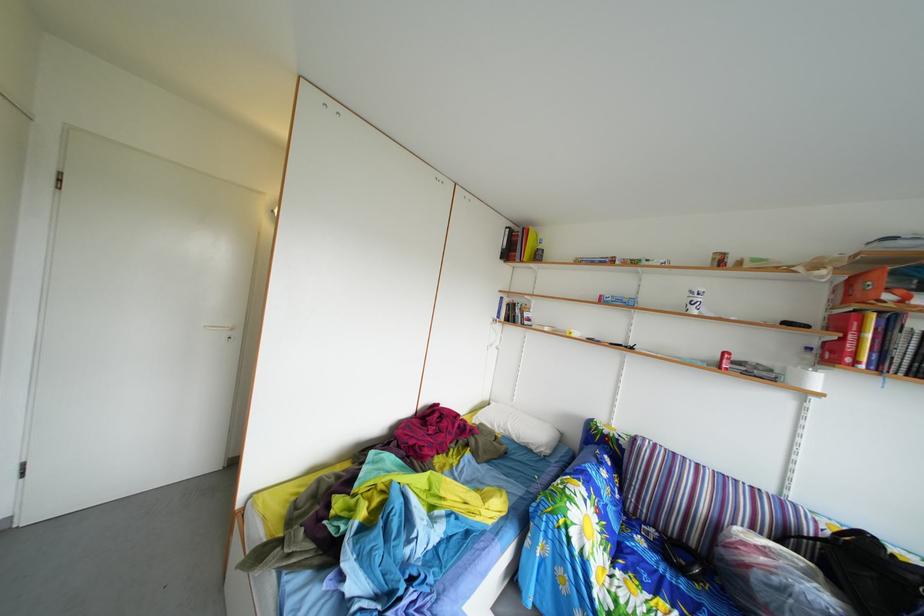
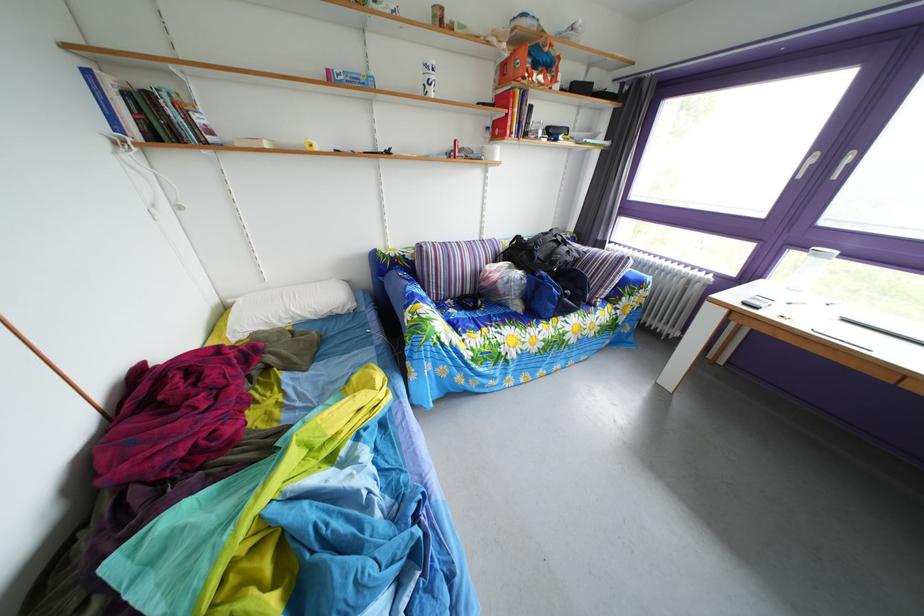
Find the pixel in the second image that matches point (612, 305) in the first image.

(339, 79)